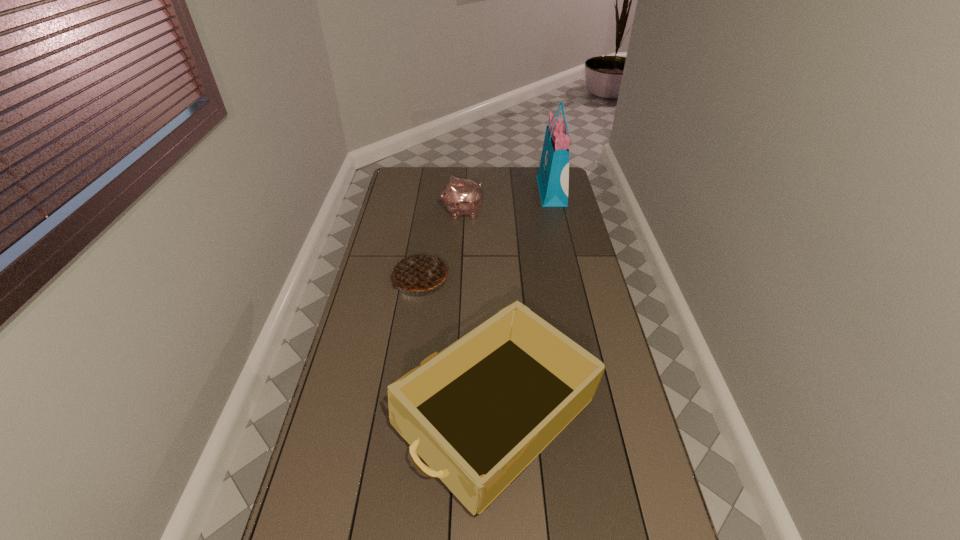
Locate an element on the screen. The image size is (960, 540). free space between the shopping bag and the box is located at coordinates (524, 304).

You are a GUI agent. You are given a task and a screenshot of the screen. Output one action in this format:
    pyautogui.click(x=<x>, y=<y>)
    Task: Click on the unoccupied position between the shopping bag and the second nearest object
    The height and width of the screenshot is (540, 960).
    Given the screenshot: What is the action you would take?
    pyautogui.click(x=486, y=235)

This screenshot has height=540, width=960. Identify the location of empty location between the third farthest object and the piggy bank. (442, 245).

Where is `vacant area between the piggy bank and the shopping bag`? The width and height of the screenshot is (960, 540). vacant area between the piggy bank and the shopping bag is located at coordinates (507, 202).

Locate an element on the screen. Image resolution: width=960 pixels, height=540 pixels. free area in between the piggy bank and the pie is located at coordinates (442, 245).

This screenshot has width=960, height=540. I want to click on free space between the shopping bag and the piggy bank, so click(507, 202).

Where is `free spot between the shopping bag and the nearest object`? This screenshot has height=540, width=960. free spot between the shopping bag and the nearest object is located at coordinates (524, 304).

Locate an element on the screen. The width and height of the screenshot is (960, 540). object that is the third closest one to the piggy bank is located at coordinates (478, 413).

The image size is (960, 540). Find the location of `object that is the third closest to the third shortest object`. object that is the third closest to the third shortest object is located at coordinates (553, 175).

The image size is (960, 540). I want to click on free space that satisfies the following two spatial constraints: 1. on the front facing side of the piggy bank; 2. on the front side of the pie, so click(x=459, y=278).